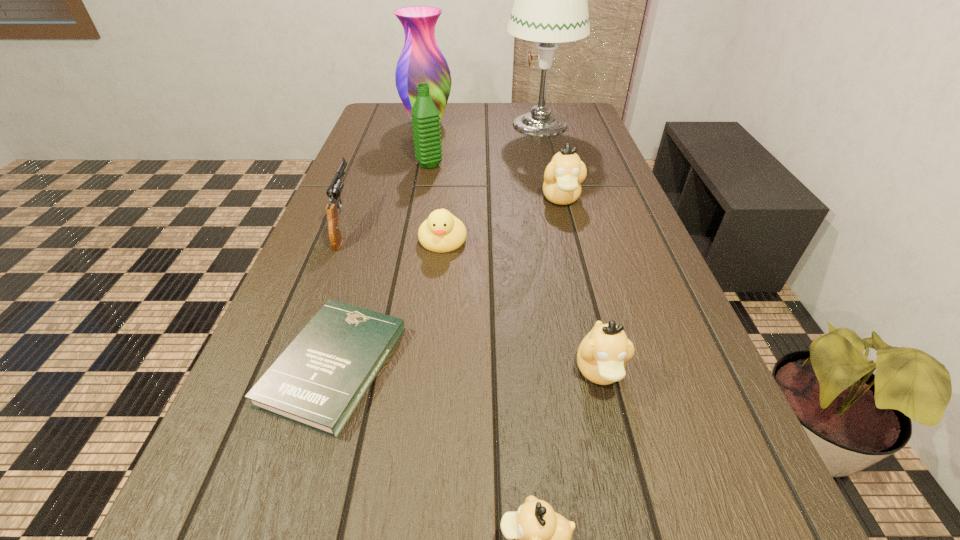
Where is `vacant space that is in between the dark book and the second nearest duckling`? vacant space that is in between the dark book and the second nearest duckling is located at coordinates (468, 369).

Image resolution: width=960 pixels, height=540 pixels. Identify the location of vacant area that lies between the yellow duckling and the book. (389, 303).

Where is `vacant space in between the second tallest object and the tallest object`? vacant space in between the second tallest object and the tallest object is located at coordinates (483, 124).

Find the location of a particular element. The width and height of the screenshot is (960, 540). empty space between the black gun and the purple vase is located at coordinates click(386, 174).

Locate which object ranks fifth in proximity to the second farthest duckling. Please provide its 2D coordinates. Your answer should be formatted as a tuple, i.e. [(x, y)], where the tuple contains the x and y coordinates of a point satisfying the conditions above.

[(602, 355)]

Identify the location of the sixth closest object to the tallest object. (318, 381).

Where is `duckling that stands as the closest to the tallest object`? duckling that stands as the closest to the tallest object is located at coordinates (563, 176).

Find the location of `duckling object that ranks as the second closest to the black gun`. duckling object that ranks as the second closest to the black gun is located at coordinates (563, 176).

The width and height of the screenshot is (960, 540). I want to click on tan duckling that is the second nearest to the farthest tan duckling, so click(x=543, y=537).

This screenshot has width=960, height=540. Identify the location of the second closest tan duckling to the gun. (602, 355).